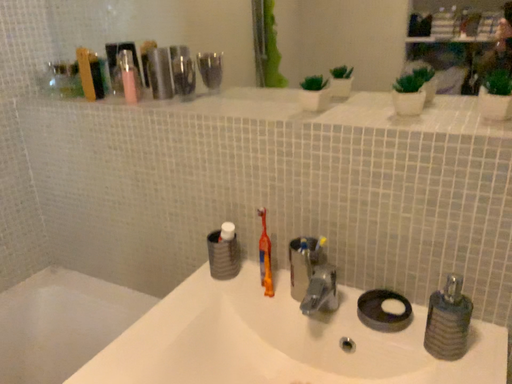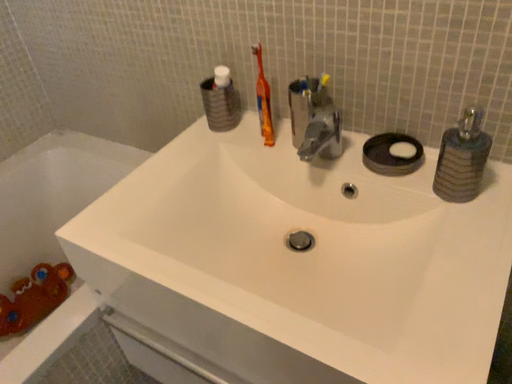
Question: How did the camera likely rotate when shooting the video?

Choices:
 (A) rotated upward
 (B) rotated downward

Answer: (B)